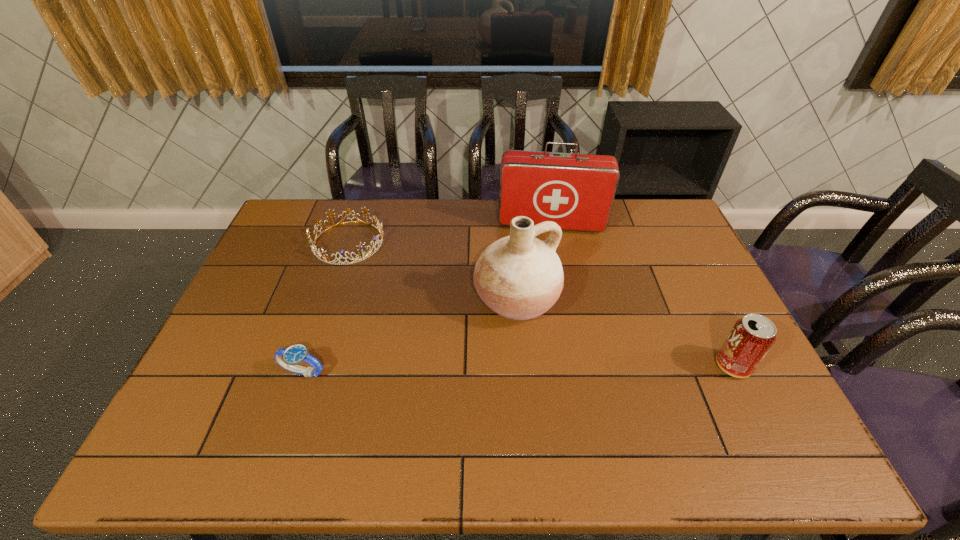
Locate an element on the screen. This screenshot has height=540, width=960. vacant area that lies between the tiara and the third farthest object is located at coordinates (432, 271).

I want to click on vacant space in between the tiara and the first-aid kit, so click(x=450, y=233).

This screenshot has height=540, width=960. In order to click on empty space between the third nearest object and the tiara in this screenshot , I will do `click(432, 271)`.

The width and height of the screenshot is (960, 540). I want to click on empty space between the first-aid kit and the rightmost object, so click(642, 295).

The height and width of the screenshot is (540, 960). In order to click on vacant area that lies between the tiara and the watch in this screenshot , I will do `click(325, 307)`.

Identify which object is the second nearest to the soda can. Please provide its 2D coordinates. Your answer should be formatted as a tuple, i.e. [(x, y)], where the tuple contains the x and y coordinates of a point satisfying the conditions above.

[(576, 191)]

Find the location of `object that is the fourth closest to the tiara`. object that is the fourth closest to the tiara is located at coordinates (752, 336).

Find the location of a particular element. The height and width of the screenshot is (540, 960). vacant space that satisfies the following two spatial constraints: 1. on the front side of the rightmost object; 2. on the left side of the tiara is located at coordinates (307, 366).

Find the location of a particular element. The width and height of the screenshot is (960, 540). vacant area that satisfies the following two spatial constraints: 1. on the back side of the first-aid kit; 2. on the left side of the pottery is located at coordinates (510, 224).

In order to click on free space in the image that satisfies the following two spatial constraints: 1. on the back side of the watch; 2. on the left side of the pottery in this screenshot , I will do `click(327, 300)`.